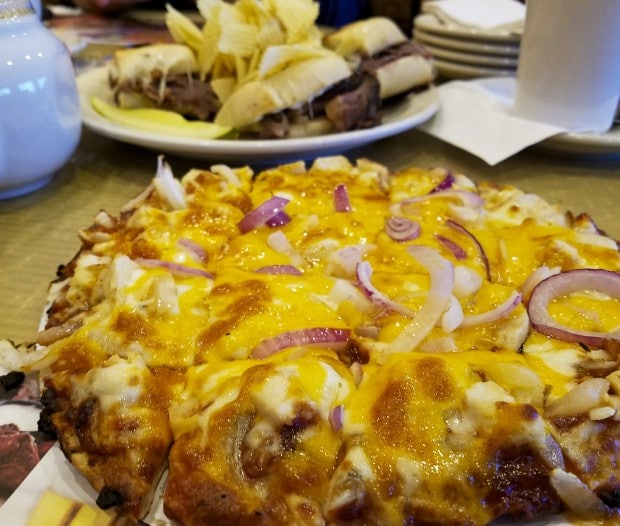
You are a GUI agent. You are given a task and a screenshot of the screen. Output one action in this format:
    pyautogui.click(x=<x>, y=<y>)
    Task: Click on the pitcher or pot
    
    Given the screenshot: What is the action you would take?
    pyautogui.click(x=28, y=67)